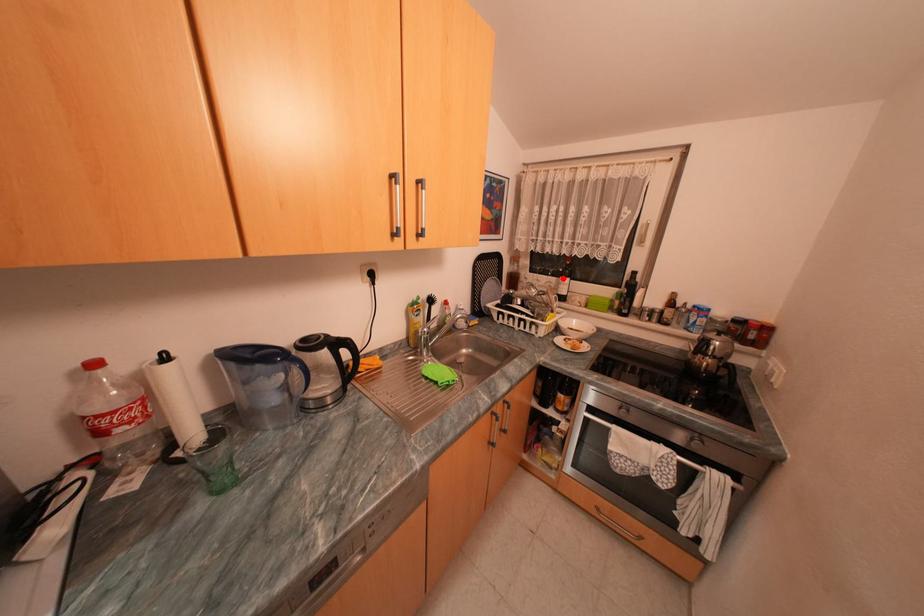
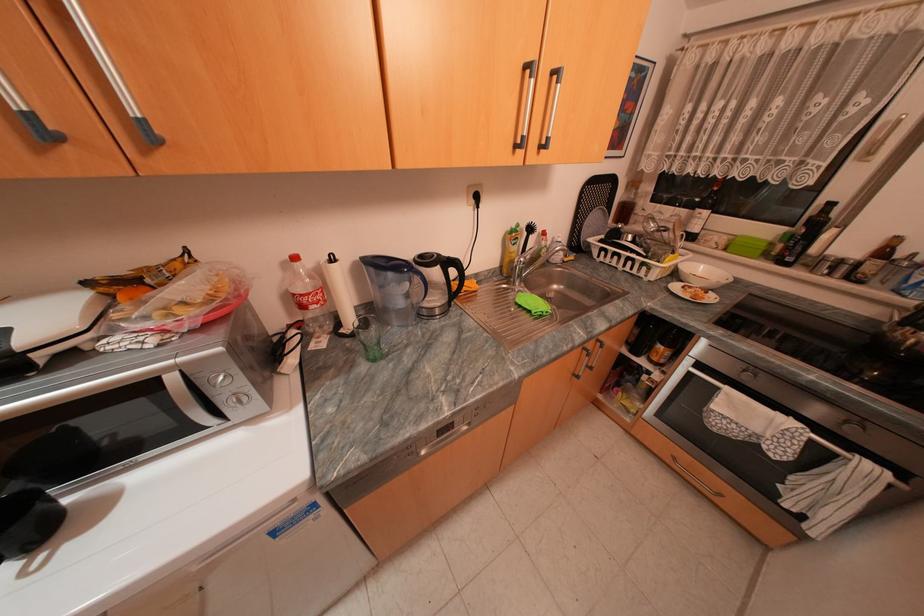
Where in the second image is the point corresponding to the highlighted location from the first image?

(694, 209)